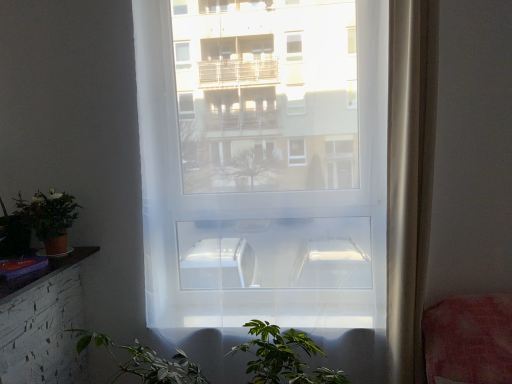
Question: Should I look upward or downward to see transparent plastic window at center?

Choices:
 (A) up
 (B) down

Answer: (B)

Question: Considering the relative positions of matte terracotta pot at lower left and sheer white curtain at right in the image provided, is matte terracotta pot at lower left to the left of sheer white curtain at right from the viewer's perspective?

Choices:
 (A) yes
 (B) no

Answer: (A)

Question: Does matte terracotta pot at lower left have a greater height compared to sheer white curtain at right?

Choices:
 (A) yes
 (B) no

Answer: (B)

Question: From the image's perspective, would you say matte terracotta pot at lower left is shown under sheer white curtain at right?

Choices:
 (A) yes
 (B) no

Answer: (A)

Question: Is matte terracotta pot at lower left further to camera compared to sheer white curtain at right?

Choices:
 (A) yes
 (B) no

Answer: (A)

Question: Is matte terracotta pot at lower left facing towards sheer white curtain at right?

Choices:
 (A) yes
 (B) no

Answer: (B)

Question: Are matte terracotta pot at lower left and sheer white curtain at right beside each other?

Choices:
 (A) no
 (B) yes

Answer: (A)

Question: Is matte terracotta pot at lower left closer to camera compared to transparent plastic window at center?

Choices:
 (A) no
 (B) yes

Answer: (A)

Question: Considering the relative sizes of matte terracotta pot at lower left and transparent plastic window at center in the image provided, is matte terracotta pot at lower left wider than transparent plastic window at center?

Choices:
 (A) no
 (B) yes

Answer: (B)

Question: Is matte terracotta pot at lower left looking in the opposite direction of transparent plastic window at center?

Choices:
 (A) yes
 (B) no

Answer: (B)

Question: From a real-world perspective, is matte terracotta pot at lower left on transparent plastic window at center?

Choices:
 (A) no
 (B) yes

Answer: (A)

Question: Considering the relative positions of matte terracotta pot at lower left and transparent plastic window at center in the image provided, is matte terracotta pot at lower left behind transparent plastic window at center?

Choices:
 (A) no
 (B) yes

Answer: (B)

Question: Could you tell me if matte terracotta pot at lower left is turned towards transparent plastic window at center?

Choices:
 (A) yes
 (B) no

Answer: (B)

Question: Is sheer white curtain at right touching transparent plastic window at center?

Choices:
 (A) no
 (B) yes

Answer: (A)